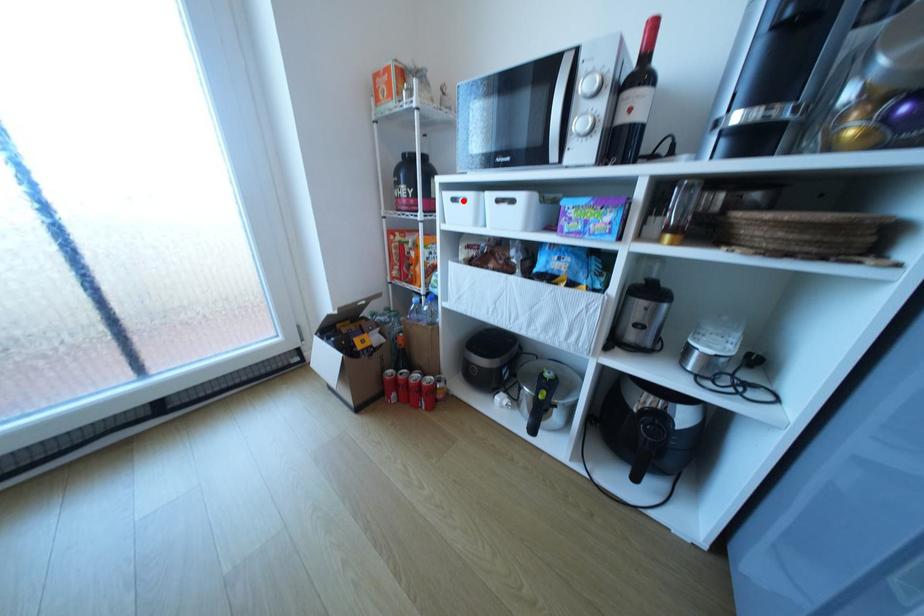
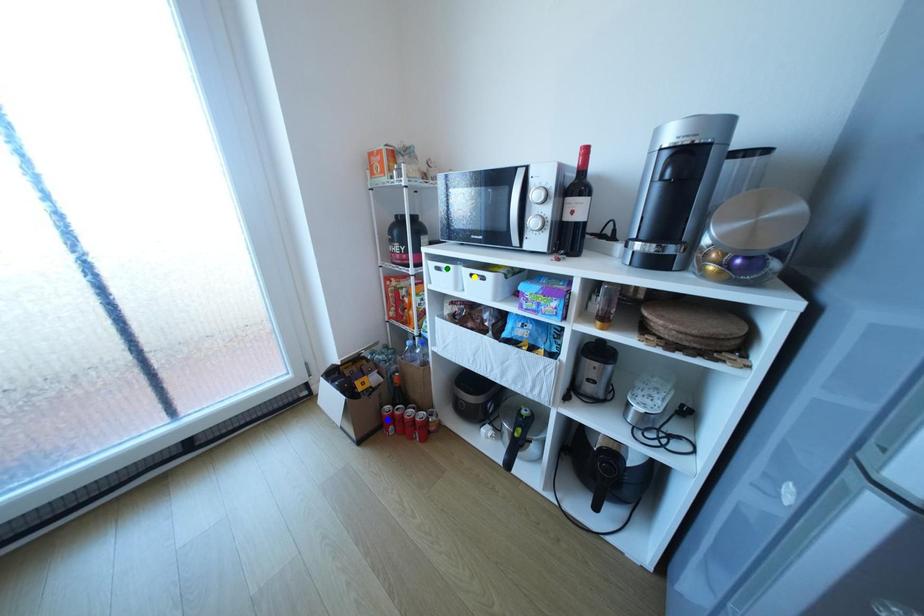
Question: I am providing you with two images of the same scene from different viewpoints. A red point is marked on the first image. You are given multiple points on the second image. Which mark in image 2 goes with the point in image 1?

Choices:
 (A) green point
 (B) blue point
 (C) yellow point

Answer: (A)